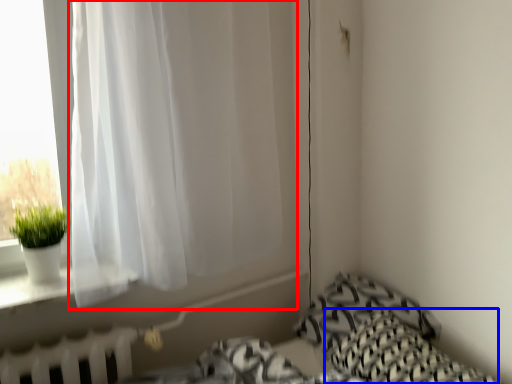
Question: Which object appears farthest to the camera in this image, curtain (highlighted by a red box) or pillow (highlighted by a blue box)?

Choices:
 (A) curtain
 (B) pillow

Answer: (A)